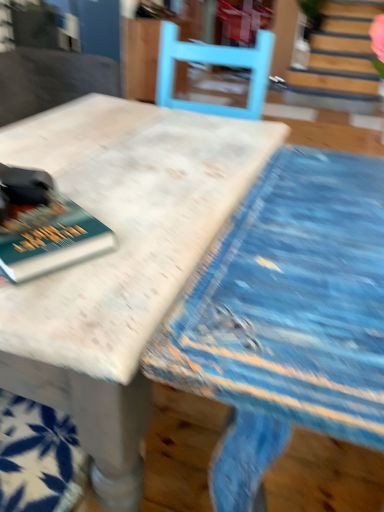
What do you see at coordinates (119, 260) in the screenshot? I see `white marble table at center` at bounding box center [119, 260].

You are a GUI agent. You are given a task and a screenshot of the screen. Output one action in this format:
    pyautogui.click(x=<x>, y=<y>)
    Task: Click on the white marble table at center
    
    Given the screenshot: What is the action you would take?
    pyautogui.click(x=119, y=260)

Where is `hardcover book at left`? hardcover book at left is located at coordinates (49, 238).

What do you see at coordinates (49, 238) in the screenshot? I see `hardcover book at left` at bounding box center [49, 238].

What is the approximate height of hardcover book at left?

The height of hardcover book at left is 1.51 inches.

The image size is (384, 512). I want to click on white marble table at center, so click(x=119, y=260).

Would you say hardcover book at left is to the left or to the right of white marble table at center in the picture?

hardcover book at left is positioned on white marble table at center's left side.

Who is more distant, hardcover book at left or white marble table at center?

hardcover book at left is further away from the camera.

Does point (32, 278) come in front of point (85, 291)?

No, (32, 278) is further to viewer.

From the image's perspective, relative to white marble table at center, is hardcover book at left above or below?

From the image's perspective, hardcover book at left appears above white marble table at center.

From a real-world perspective, relative to white marble table at center, is hardcover book at left vertically above or below?

hardcover book at left is above white marble table at center.

Considering the sizes of objects hardcover book at left and white marble table at center in the image provided, who is thinner, hardcover book at left or white marble table at center?

With smaller width is hardcover book at left.

Between hardcover book at left and white marble table at center, which one has less height?

hardcover book at left.

Who is smaller, hardcover book at left or white marble table at center?

With smaller size is hardcover book at left.

Would you say hardcover book at left is outside white marble table at center?

That's incorrect, hardcover book at left is not completely outside white marble table at center.

Can you see hardcover book at left touching white marble table at center?

They are not placed beside each other.

Is hardcover book at left facing away from white marble table at center?

No, hardcover book at left's orientation is not away from white marble table at center.

Can you tell me how much hardcover book at left and white marble table at center differ in facing direction?

The facing directions of hardcover book at left and white marble table at center are 61 degrees apart.

You are a GUI agent. You are given a task and a screenshot of the screen. Output one action in this format:
    pyautogui.click(x=<x>, y=<y>)
    Task: Click on the table below the hardcover book at left (from a real-world perspective)
    Image resolution: width=384 pixels, height=512 pixels.
    Given the screenshot: What is the action you would take?
    pyautogui.click(x=119, y=260)

Which object is positioned more to the left, white marble table at center or hardcover book at left?

hardcover book at left is more to the left.

Which object is more forward, white marble table at center or hardcover book at left?

Positioned in front is white marble table at center.

Is point (126, 220) more distant than point (72, 240)?

That is True.

From the image's perspective, who appears lower, white marble table at center or hardcover book at left?

white marble table at center appears lower in the image.

From a real-world perspective, is white marble table at center over hardcover book at left?

No, from a real-world perspective, white marble table at center is not above hardcover book at left.

Looking at their sizes, would you say white marble table at center is wider or thinner than hardcover book at left?

white marble table at center is wider than hardcover book at left.

Considering the sizes of objects white marble table at center and hardcover book at left in the image provided, who is shorter, white marble table at center or hardcover book at left?

With less height is hardcover book at left.

Is white marble table at center smaller than hardcover book at left?

Incorrect, white marble table at center is not smaller in size than hardcover book at left.

Do you think white marble table at center is within hardcover book at left, or outside of it?

white marble table at center is spatially situated outside hardcover book at left.

Are white marble table at center and hardcover book at left making contact?

No, white marble table at center is not in contact with hardcover book at left.

Is white marble table at center oriented away from hardcover book at left?

No, white marble table at center's orientation is not away from hardcover book at left.

What's the angular difference between white marble table at center and hardcover book at left's facing directions?

61 degrees separate the facing orientations of white marble table at center and hardcover book at left.

Locate an element on the screen. The width and height of the screenshot is (384, 512). book above the white marble table at center (from the image's perspective) is located at coordinates click(49, 238).

Image resolution: width=384 pixels, height=512 pixels. What are the coordinates of `book above the white marble table at center (from a real-world perspective)` in the screenshot? It's located at (49, 238).

Image resolution: width=384 pixels, height=512 pixels. In order to click on book that appears behind the white marble table at center in this screenshot , I will do `click(49, 238)`.